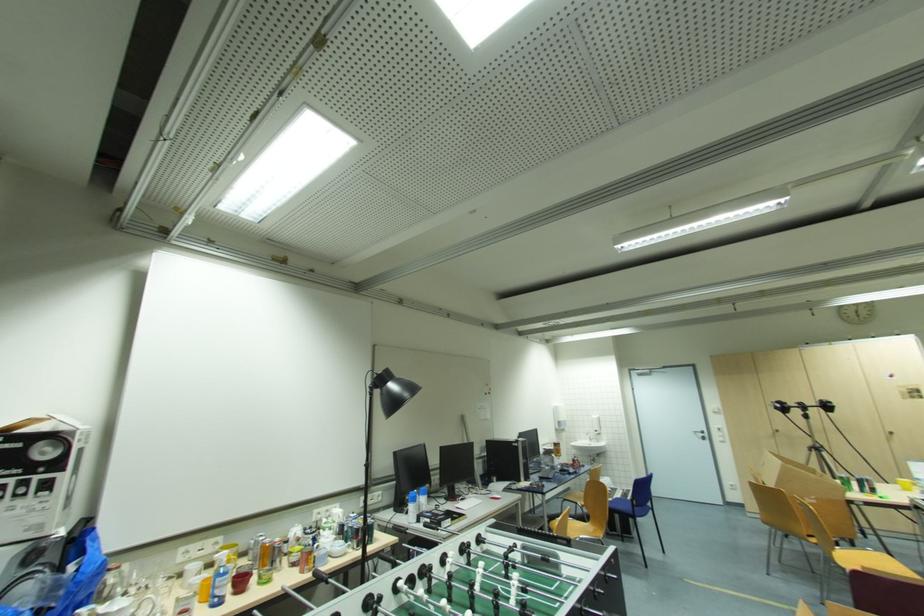
This screenshot has height=616, width=924. What do you see at coordinates (699, 434) in the screenshot?
I see `the white door handle` at bounding box center [699, 434].